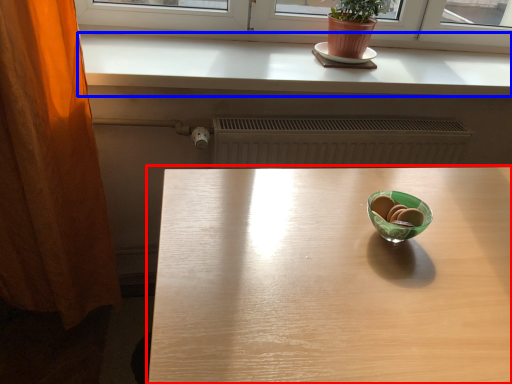
Question: Which object appears closest to the camera in this image, table (highlighted by a red box) or counter top (highlighted by a blue box)?

Choices:
 (A) table
 (B) counter top

Answer: (A)